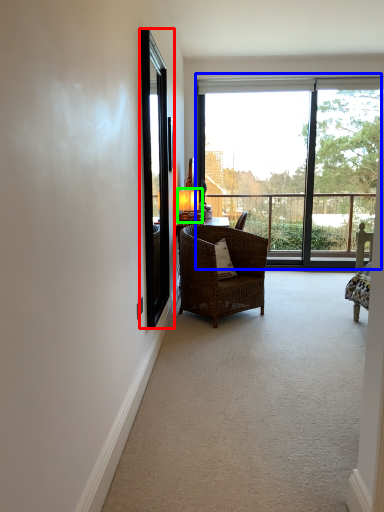
Question: Based on their relative distances, which object is nearer to screen door (highlighted by a red box)? Choose from window (highlighted by a blue box) and table lamp (highlighted by a green box).

Choices:
 (A) window
 (B) table lamp

Answer: (B)